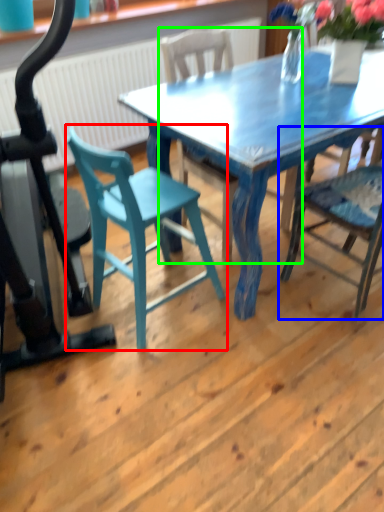
Question: Which object is the closest to the chair (highlighted by a red box)? Choose among these: chair (highlighted by a blue box) or chair (highlighted by a green box).

Choices:
 (A) chair
 (B) chair

Answer: (A)